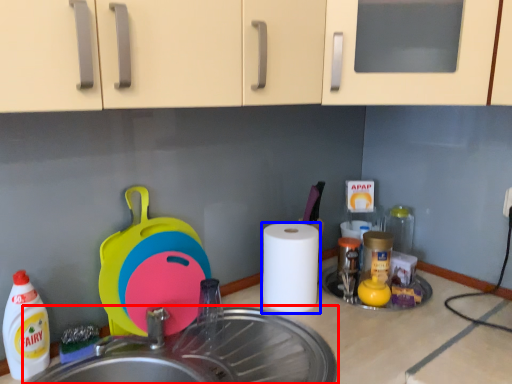
Question: Which object appears farthest to the camera in this image, sink (highlighted by a red box) or paper towel (highlighted by a blue box)?

Choices:
 (A) sink
 (B) paper towel

Answer: (B)